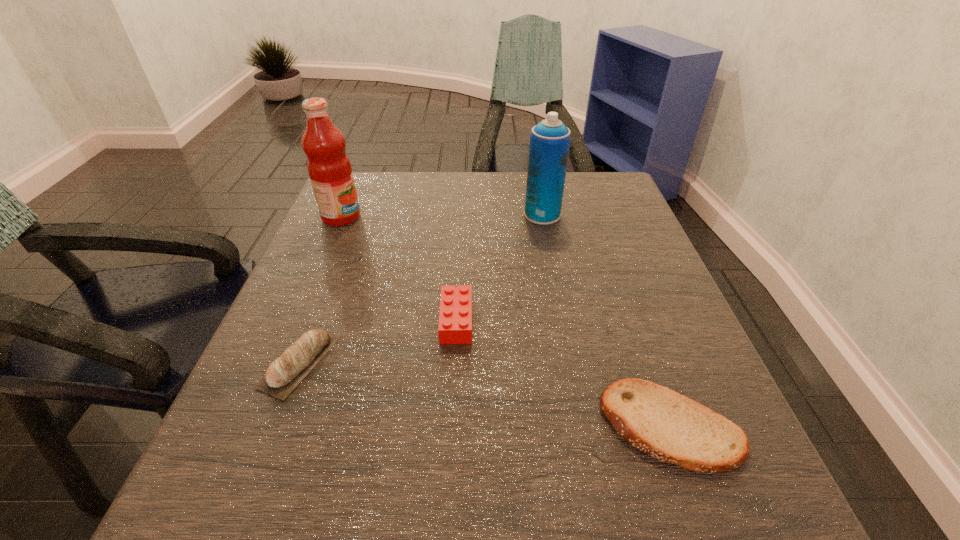
This screenshot has width=960, height=540. Identify the location of vacant area between the third object from left to right and the left pita bread. (378, 341).

In order to click on unoccupied position between the aerosol can and the left pita bread in this screenshot , I will do `click(421, 288)`.

At what (x,y) coordinates should I click in order to perform the action: click on vacant area between the Lego and the right pita bread. Please return your answer as a coordinate pair (x, y). Looking at the image, I should click on (564, 373).

Identify the location of empty space that is in between the fruit juice and the aerosol can. The height and width of the screenshot is (540, 960). (442, 216).

I want to click on vacant area that lies between the aerosol can and the right pita bread, so click(x=607, y=320).

This screenshot has width=960, height=540. I want to click on object that stands as the third closest to the fruit juice, so click(x=550, y=139).

Locate which object ranks third in proximity to the fruit juice. Please provide its 2D coordinates. Your answer should be formatted as a tuple, i.e. [(x, y)], where the tuple contains the x and y coordinates of a point satisfying the conditions above.

[(550, 139)]

Find the location of a particular element. free region that satisfies the following two spatial constraints: 1. on the front label of the fruit juice; 2. on the back side of the left pita bread is located at coordinates (279, 361).

Where is `free space that satisfies the following two spatial constraints: 1. on the front label of the right pita bread; 2. on the left side of the fruit juice`? free space that satisfies the following two spatial constraints: 1. on the front label of the right pita bread; 2. on the left side of the fruit juice is located at coordinates (252, 426).

Where is `free space that satisfies the following two spatial constraints: 1. on the front label of the fruit juice; 2. on the back side of the right pita bread`? The width and height of the screenshot is (960, 540). free space that satisfies the following two spatial constraints: 1. on the front label of the fruit juice; 2. on the back side of the right pita bread is located at coordinates (252, 426).